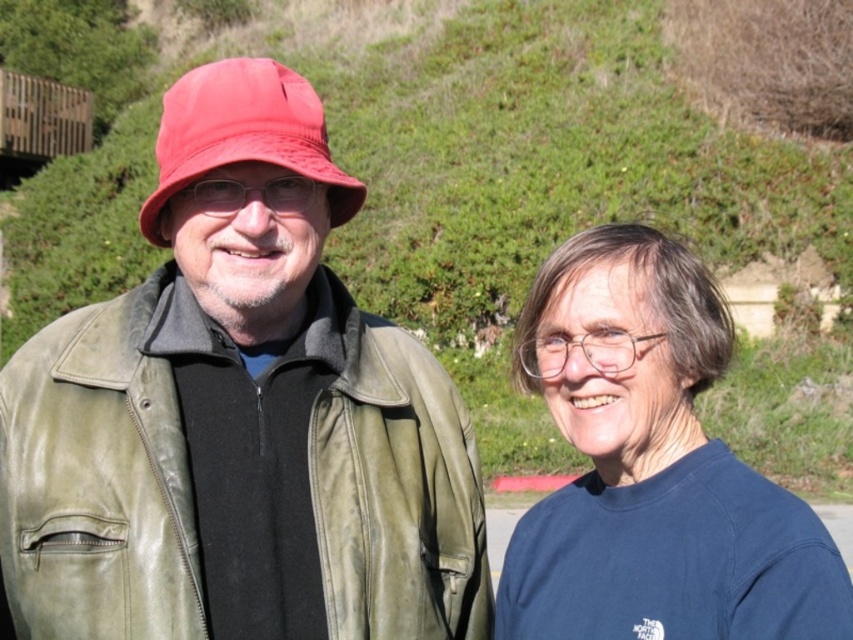
Based on the photo, can you confirm if matte green leather jacket at left is positioned to the right of blue cotton shirt at right?

No, matte green leather jacket at left is not to the right of blue cotton shirt at right.

Who is more distant from viewer, [303,422] or [592,525]?

Point [592,525]

This screenshot has height=640, width=853. Identify the location of matte green leather jacket at left. (238, 417).

Who is lower down, blue cotton shirt at right or matte red bucket hat at left?

Positioned lower is blue cotton shirt at right.

Is the position of blue cotton shirt at right less distant than that of matte red bucket hat at left?

Yes, it is.

I want to click on blue cotton shirt at right, so click(653, 467).

Who is shorter, matte green leather jacket at left or matte red bucket hat at left?

matte green leather jacket at left

Is matte green leather jacket at left thinner than matte red bucket hat at left?

Indeed, matte green leather jacket at left has a lesser width compared to matte red bucket hat at left.

Is point (221, 404) behind point (155, 240)?

No.

The height and width of the screenshot is (640, 853). What are the coordinates of `matte green leather jacket at left` in the screenshot? It's located at (238, 417).